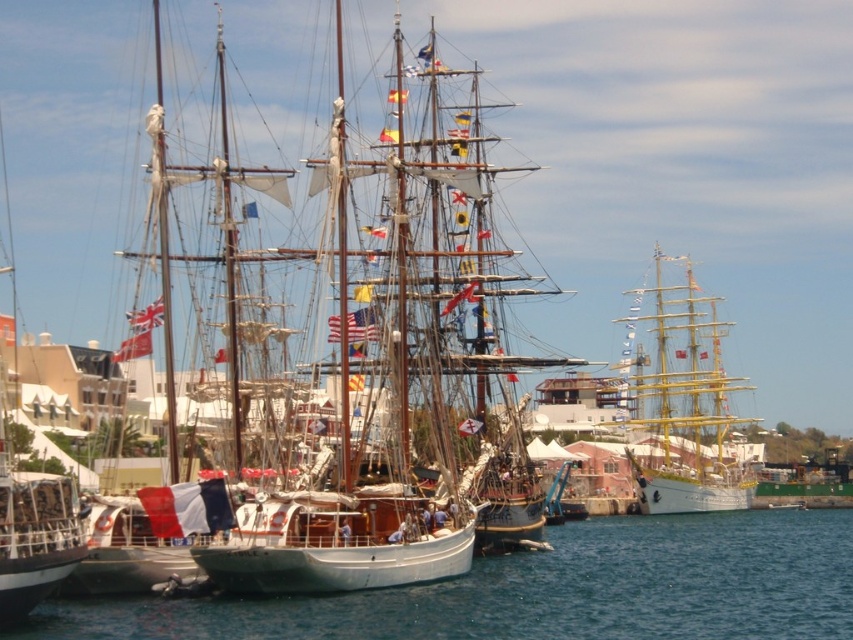
Is clear blue water at center below yellow polished wood sailboat at right?

Indeed, clear blue water at center is positioned under yellow polished wood sailboat at right.

Is clear blue water at center to the left of yellow polished wood sailboat at right from the viewer's perspective?

Yes, clear blue water at center is to the left of yellow polished wood sailboat at right.

Locate an element on the screen. The image size is (853, 640). clear blue water at center is located at coordinates (548, 589).

Does point (239, 438) come farther from viewer compared to point (599, 621)?

That is True.

Does wooden ship at center have a lesser height compared to clear blue water at center?

No.

Between point (438, 225) and point (775, 620), which one is positioned in front?

Point (775, 620) is in front.

What are the coordinates of `wooden ship at center` in the screenshot? It's located at (363, 372).

Looking at this image, is wooden ship at center further to the viewer compared to yellow polished wood sailboat at right?

That is False.

Who is lower down, wooden ship at center or yellow polished wood sailboat at right?

Positioned lower is yellow polished wood sailboat at right.

Locate an element on the screen. The width and height of the screenshot is (853, 640). wooden ship at center is located at coordinates (363, 372).